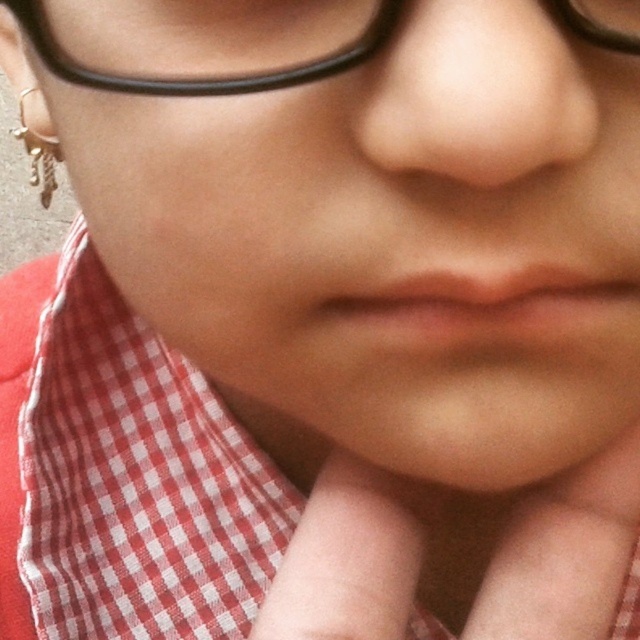
Is black plastic glasses at upper center to the left of gold metallic chain at lower left from the viewer's perspective?

No, black plastic glasses at upper center is not to the left of gold metallic chain at lower left.

Between black plastic glasses at upper center and gold metallic chain at lower left, which one appears on the left side from the viewer's perspective?

Positioned to the left is gold metallic chain at lower left.

At what (x,y) coordinates should I click in order to perform the action: click on black plastic glasses at upper center. Please return your answer as a coordinate pair (x, y). Looking at the image, I should click on (202, 42).

Is point (58, 593) positioned after point (262, 48)?

Yes, point (58, 593) is behind point (262, 48).

Is point (38, 406) farther from viewer compared to point (192, 29)?

Yes, point (38, 406) is farther from viewer.

Identify the location of red checkered fabric at center. 124,474.

Does red checkered fabric at center come in front of gold metallic chain at lower left?

No, red checkered fabric at center is further to the viewer.

From the picture: Measure the distance between red checkered fabric at center and gold metallic chain at lower left.

red checkered fabric at center and gold metallic chain at lower left are 15.35 centimeters apart.

Image resolution: width=640 pixels, height=640 pixels. Identify the location of red checkered fabric at center. (124, 474).